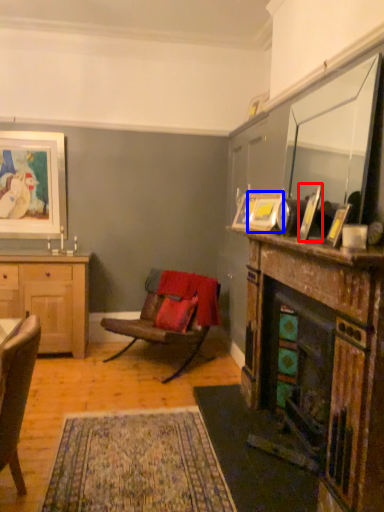
Question: Among these objects, which one is nearest to the camera, picture frame (highlighted by a red box) or picture frame (highlighted by a blue box)?

Choices:
 (A) picture frame
 (B) picture frame

Answer: (A)